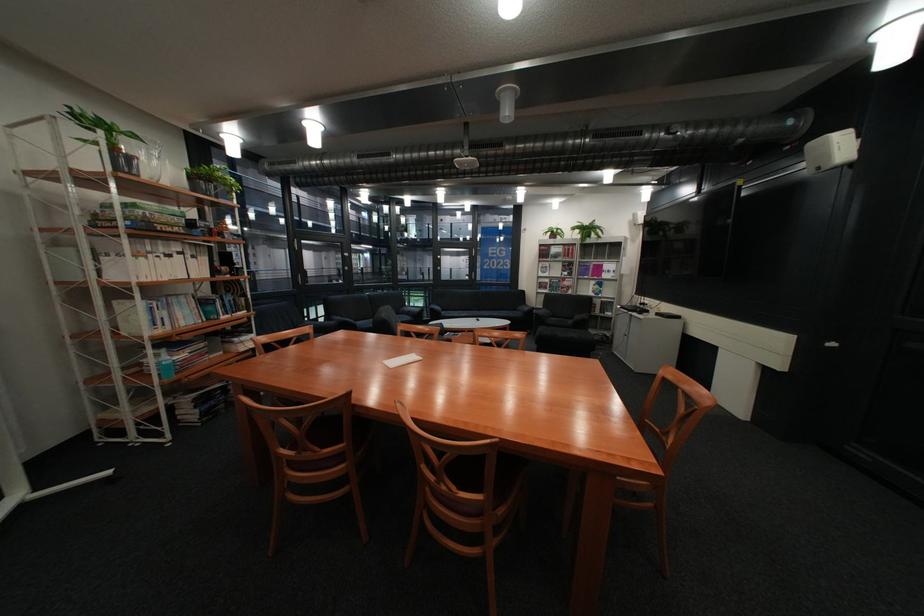
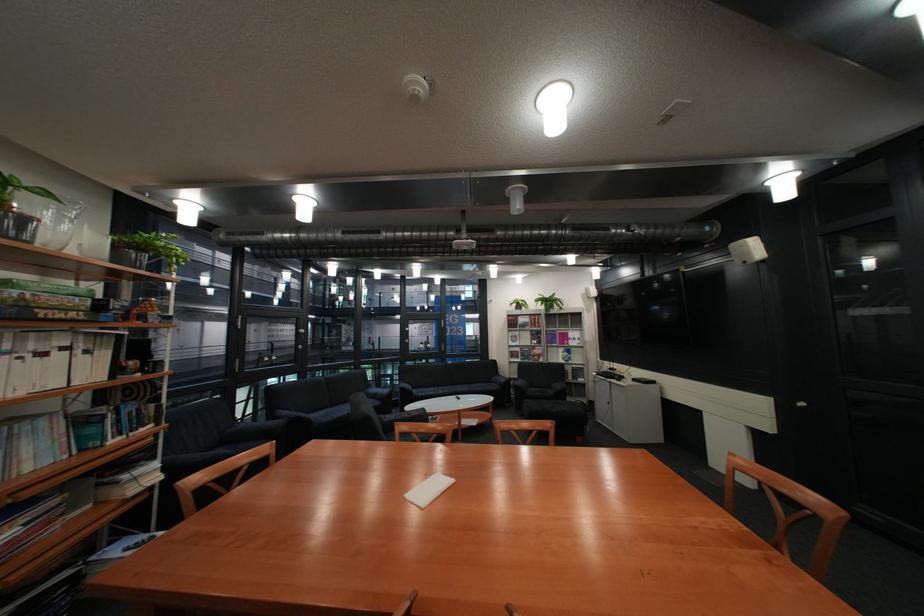
Question: How did the camera likely rotate?

Choices:
 (A) Left
 (B) Right
 (C) Up
 (D) Down

Answer: (C)